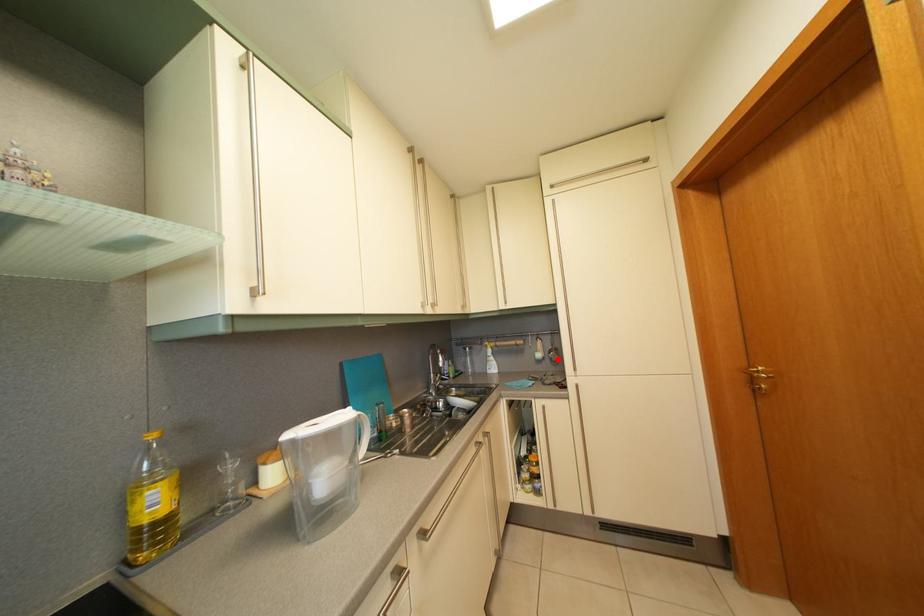
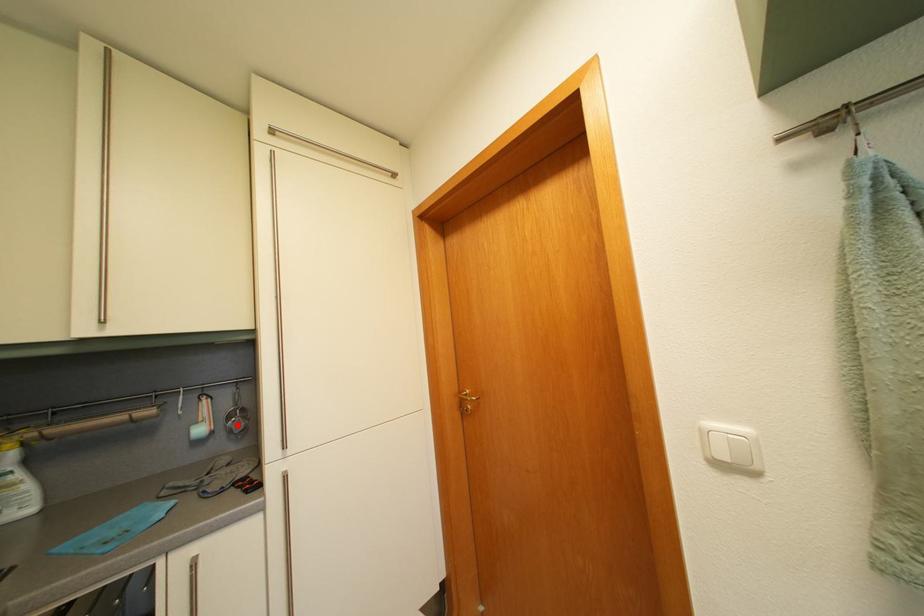
I am providing you with two images of the same scene from different viewpoints. A red point is marked on the first image and another point is marked on the second image. Is the marked point in image1 the same physical position as the marked point in image2?

Yes